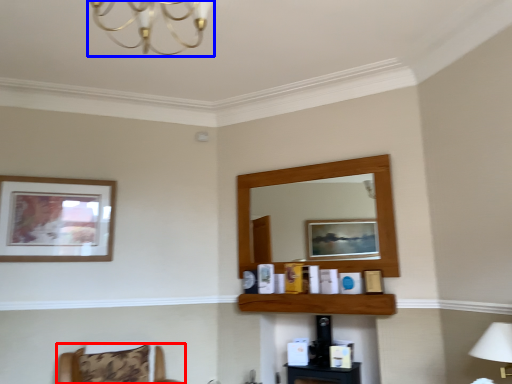
Question: Which object is closer to the camera taking this photo, furniture (highlighted by a red box) or light fixture (highlighted by a blue box)?

Choices:
 (A) furniture
 (B) light fixture

Answer: (B)